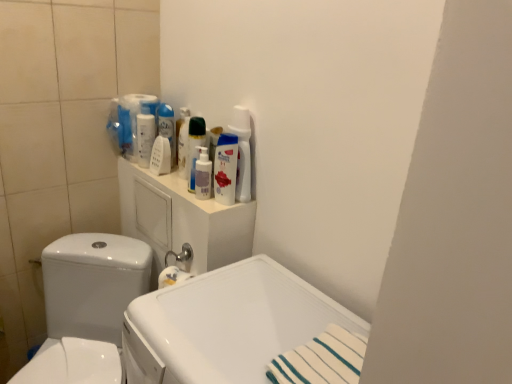
Question: Could you tell me if white glossy spray bottle at upper center, which is counted as the first cleaning product, starting from the left, is turned towards white plastic medicine cabinet at upper center?

Choices:
 (A) no
 (B) yes

Answer: (A)

Question: Is white glossy spray bottle at upper center, which is counted as the first cleaning product, starting from the left, taller than white plastic medicine cabinet at upper center?

Choices:
 (A) yes
 (B) no

Answer: (B)

Question: Is white glossy spray bottle at upper center, which is the 4th cleaning product from right to left, in front of white plastic medicine cabinet at upper center?

Choices:
 (A) yes
 (B) no

Answer: (B)

Question: Is white glossy spray bottle at upper center, which is counted as the first cleaning product, starting from the left, positioned with its back to white plastic medicine cabinet at upper center?

Choices:
 (A) yes
 (B) no

Answer: (B)

Question: Is the position of white glossy spray bottle at upper center, which is counted as the first cleaning product, starting from the left, more distant than that of white plastic medicine cabinet at upper center?

Choices:
 (A) no
 (B) yes

Answer: (B)

Question: Considering the positions of white glossy bottle at upper center, acting as the 2th cleaning product starting from the left, and translucent plastic pump bottle at center, which appears as the 2th cleaning product when viewed from the right, in the image, is white glossy bottle at upper center, acting as the 2th cleaning product starting from the left, bigger or smaller than translucent plastic pump bottle at center, which appears as the 2th cleaning product when viewed from the right,?

Choices:
 (A) small
 (B) big

Answer: (A)

Question: From the image's perspective, is white glossy bottle at upper center, acting as the 2th cleaning product starting from the left, above or below translucent plastic pump bottle at center, which appears as the 2th cleaning product when viewed from the right?

Choices:
 (A) below
 (B) above

Answer: (B)

Question: Do you think white glossy bottle at upper center, acting as the 2th cleaning product starting from the left, is within translucent plastic pump bottle at center, which appears as the 2th cleaning product when viewed from the right, or outside of it?

Choices:
 (A) inside
 (B) outside

Answer: (B)

Question: Is white glossy bottle at upper center, the 3th cleaning product viewed from the right, wider or thinner than translucent plastic pump bottle at center, which appears as the 2th cleaning product when viewed from the right?

Choices:
 (A) wide
 (B) thin

Answer: (B)

Question: From the image's perspective, is white glossy sink at center positioned above or below semi-glossy white bottle at upper center, which appears as the 1th mouthwash when viewed from the right?

Choices:
 (A) above
 (B) below

Answer: (B)

Question: Based on their sizes in the image, would you say white glossy sink at center is bigger or smaller than semi-glossy white bottle at upper center, the first mouthwash in the front-to-back sequence?

Choices:
 (A) small
 (B) big

Answer: (B)

Question: Is point (126, 311) closer or farther from the camera than point (207, 157)?

Choices:
 (A) closer
 (B) farther

Answer: (A)

Question: Is white glossy sink at center in front of or behind semi-glossy white bottle at upper center, which appears as the 1th mouthwash when viewed from the right, in the image?

Choices:
 (A) behind
 (B) front

Answer: (B)

Question: In the image, is white glossy toilet at left positioned in front of or behind white glossy bottle at upper center, which is counted as the 1th cleaning product, starting from the right?

Choices:
 (A) front
 (B) behind

Answer: (A)

Question: Is white glossy toilet at left inside or outside of white glossy bottle at upper center, which is counted as the 1th cleaning product, starting from the right?

Choices:
 (A) outside
 (B) inside

Answer: (A)